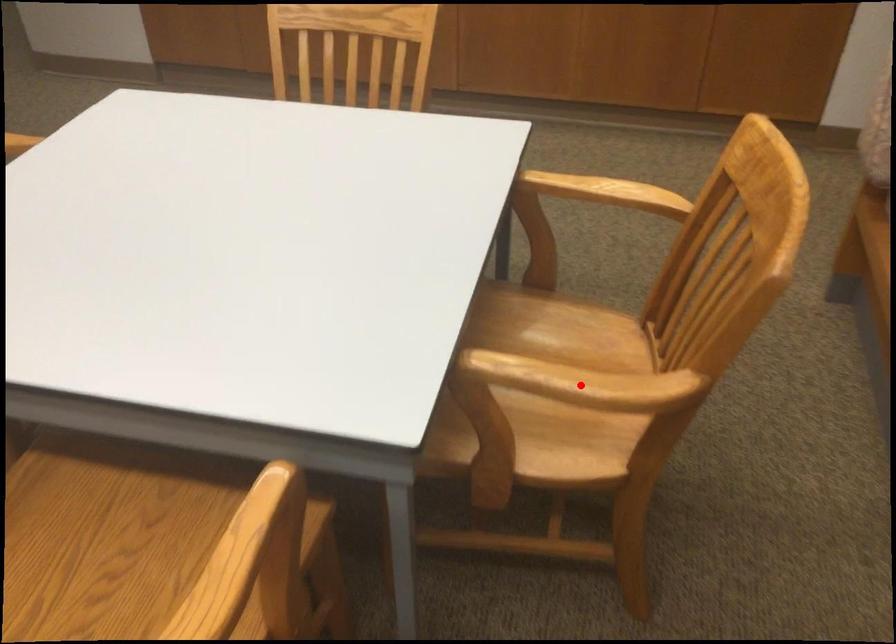
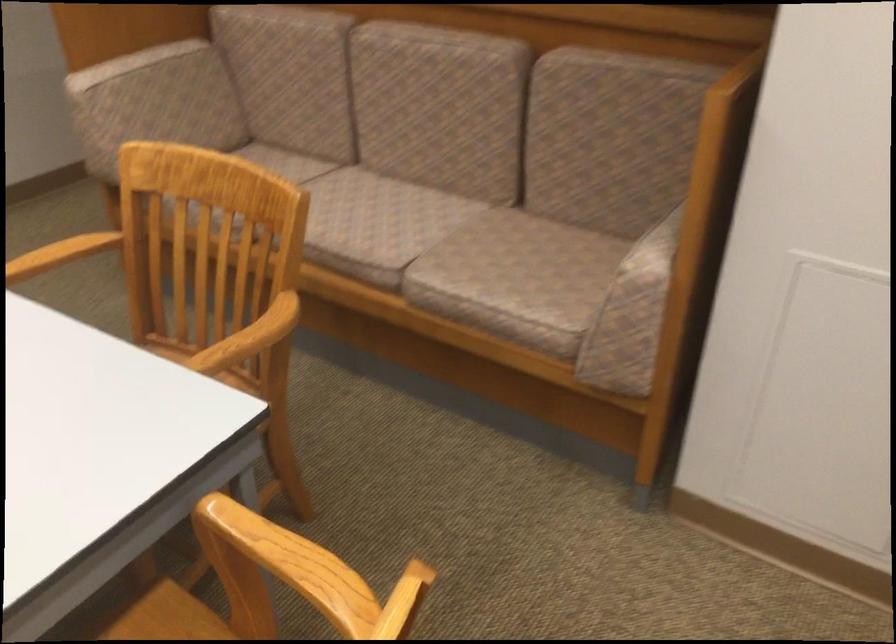
Question: I am providing you with two images of the same scene from different viewpoints. In image1, a red point is highlighted. Considering the same 3D point in image2, which of the following is correct?

Choices:
 (A) It is closer
 (B) It is farther

Answer: (B)